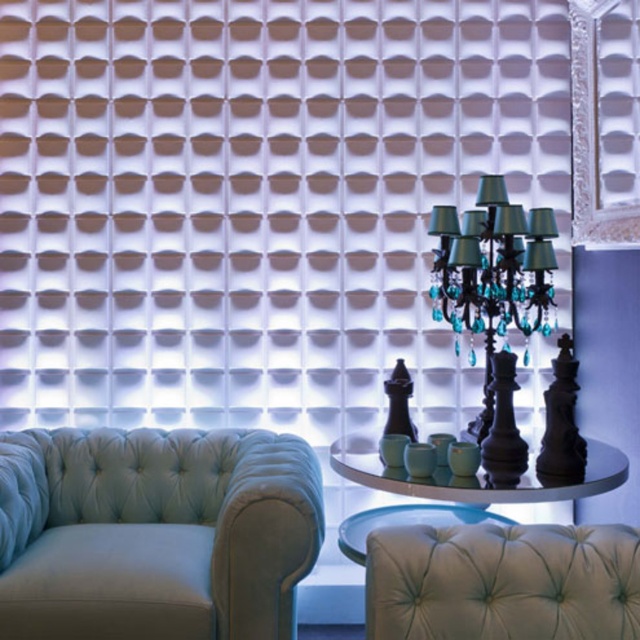
Which is more to the right, tufted leather armchair at center or black glass chandelier at center?

black glass chandelier at center

Is point (410, 598) farther from camera compared to point (483, 173)?

No, (410, 598) is closer to viewer.

At what (x,y) coordinates should I click in order to perform the action: click on tufted leather armchair at center. Please return your answer as a coordinate pair (x, y). Looking at the image, I should click on (502, 582).

Is point (97, 538) closer to viewer compared to point (417, 483)?

No, (97, 538) is further to viewer.

Who is more distant from viewer, (182, 429) or (371, 476)?

Positioned behind is point (182, 429).

Which is in front, point (136, 497) or point (364, 438)?

Positioned in front is point (136, 497).

Where is `light blue velvet couch at lower left`? The width and height of the screenshot is (640, 640). light blue velvet couch at lower left is located at coordinates (160, 528).

Consider the image. Is light blue velvet couch at lower left wider than black glass chandelier at center?

Yes, light blue velvet couch at lower left is wider than black glass chandelier at center.

Who is positioned more to the left, light blue velvet couch at lower left or black glass chandelier at center?

From the viewer's perspective, light blue velvet couch at lower left appears more on the left side.

The image size is (640, 640). Describe the element at coordinates (160, 528) in the screenshot. I see `light blue velvet couch at lower left` at that location.

Locate an element on the screen. Image resolution: width=640 pixels, height=640 pixels. light blue velvet couch at lower left is located at coordinates tap(160, 528).